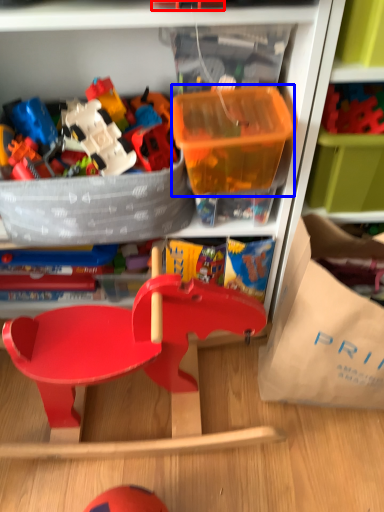
Question: Which object appears farthest to the camera in this image, toy (highlighted by a red box) or storage box (highlighted by a blue box)?

Choices:
 (A) toy
 (B) storage box

Answer: (B)